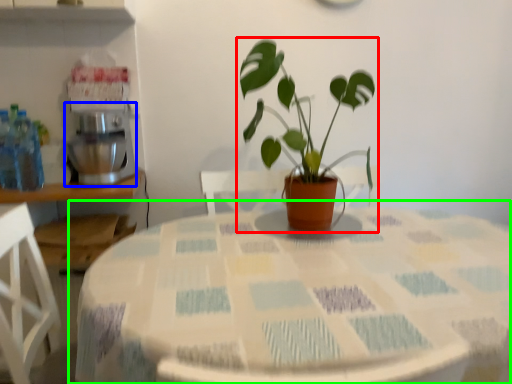
Question: Which object is the closest to the houseplant (highlighted by a red box)? Choose among these: mixer (highlighted by a blue box) or table (highlighted by a green box).

Choices:
 (A) mixer
 (B) table

Answer: (B)